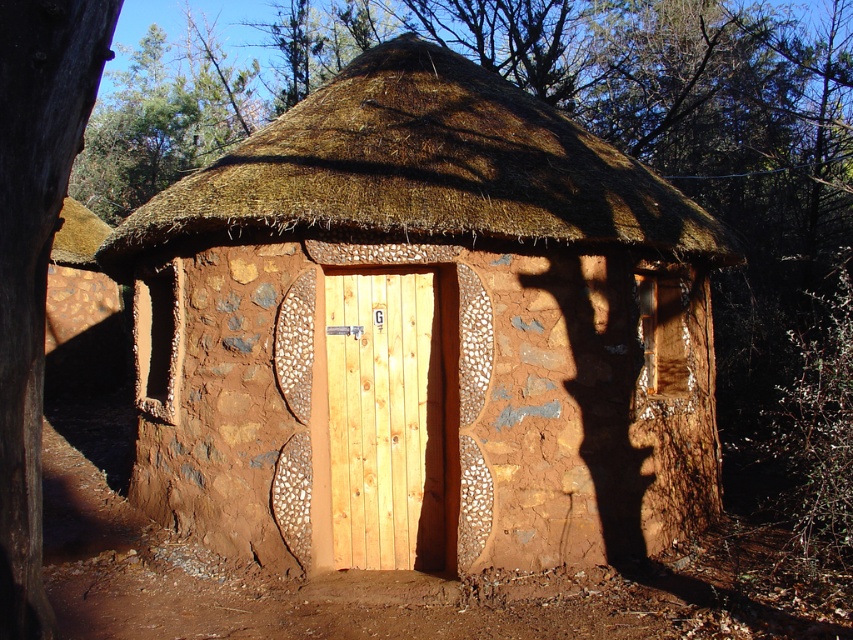
Question: Among these objects, which one is nearest to the camera?

Choices:
 (A) brown thatch at upper center
 (B) light brown wood door at center

Answer: (A)

Question: Does brown textured mud hut at center appear on the left side of light brown wood door at center?

Choices:
 (A) yes
 (B) no

Answer: (B)

Question: Does brown thatch at upper center have a lesser width compared to light brown wood door at center?

Choices:
 (A) no
 (B) yes

Answer: (A)

Question: Is the position of brown textured mud hut at center more distant than that of light brown wood door at center?

Choices:
 (A) no
 (B) yes

Answer: (A)

Question: Which point appears farthest from the camera in this image?

Choices:
 (A) (630, 268)
 (B) (408, 365)

Answer: (A)

Question: Which object is closer to the camera taking this photo?

Choices:
 (A) light brown wood door at center
 (B) brown textured mud hut at center
 (C) brown thatch at upper center

Answer: (B)